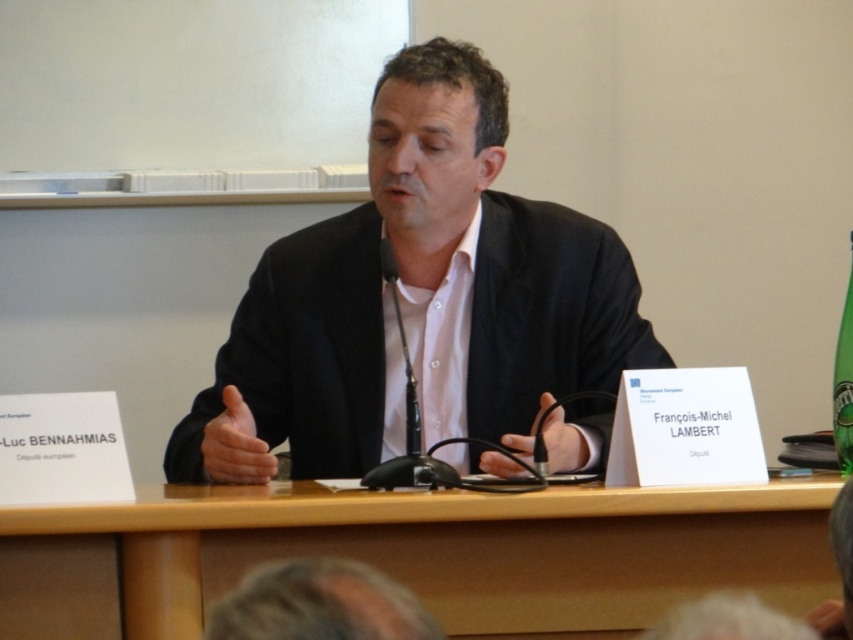
Is gray hair at lower center behind black matte microphone at center?

No, it is not.

Is gray hair at lower center thinner than black matte microphone at center?

No, gray hair at lower center is not thinner than black matte microphone at center.

Who is more forward, (346, 580) or (485, 452)?

Positioned in front is point (346, 580).

I want to click on gray hair at lower center, so click(x=318, y=604).

Can you confirm if gray hair at lower center is wider than matte black hand at center?

Yes, gray hair at lower center is wider than matte black hand at center.

Looking at this image, who is more forward, (289, 573) or (247, 435)?

Positioned in front is point (289, 573).

Locate an element on the screen. This screenshot has height=640, width=853. gray hair at lower center is located at coordinates (318, 604).

Who is shorter, matte black hand at center or black matte microphone at center?

With less height is black matte microphone at center.

This screenshot has height=640, width=853. Describe the element at coordinates (235, 444) in the screenshot. I see `matte black hand at center` at that location.

Locate an element on the screen. The height and width of the screenshot is (640, 853). matte black hand at center is located at coordinates (235, 444).